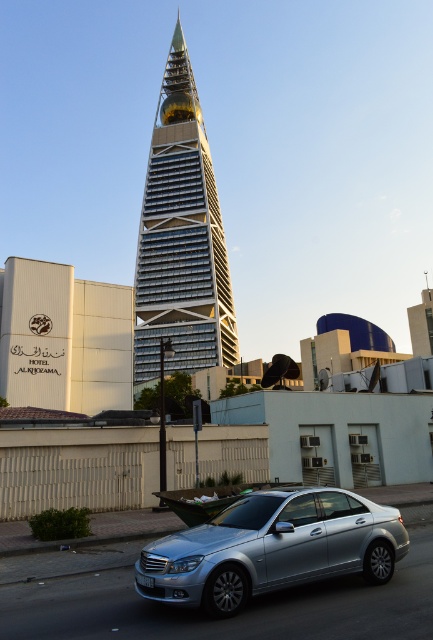
Question: Which point is farther from the camera taking this photo?

Choices:
 (A) (355, 532)
 (B) (136, 301)

Answer: (B)

Question: Is silver metallic skyscraper at center further to the viewer compared to silver metallic car at center?

Choices:
 (A) no
 (B) yes

Answer: (B)

Question: Is silver metallic skyscraper at center above silver metallic car at center?

Choices:
 (A) no
 (B) yes

Answer: (B)

Question: Does silver metallic skyscraper at center appear under silver metallic car at center?

Choices:
 (A) yes
 (B) no

Answer: (B)

Question: Which point is farther from the camera taking this photo?

Choices:
 (A) (230, 324)
 (B) (146, 547)

Answer: (A)